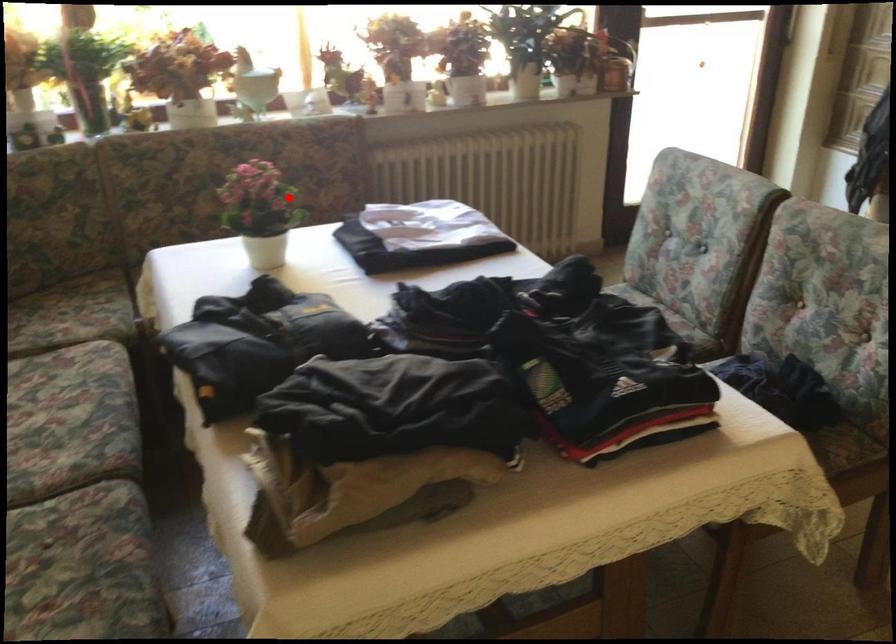
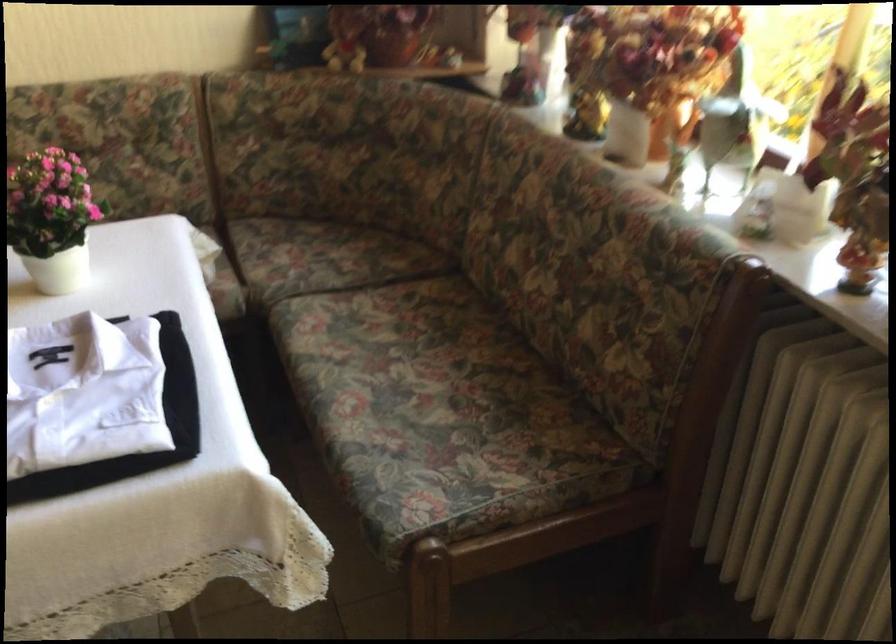
Question: I am providing you with two images of the same scene from different viewpoints. A red point is marked on the first image. Is the red point's position out of view in image 2?

Choices:
 (A) Yes
 (B) No

Answer: (B)